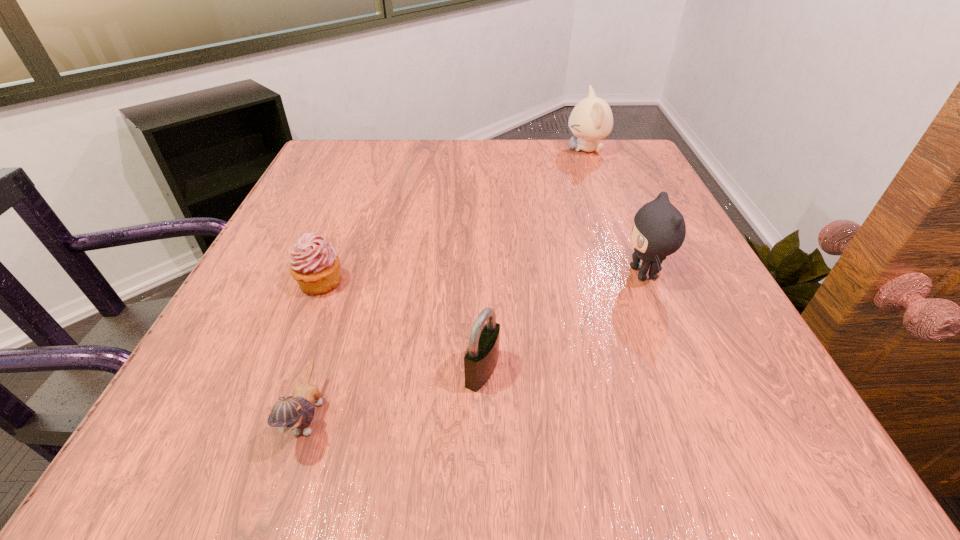
Where is `vacant space situated 0.250m on the front-facing side of the second nearest kitten`? vacant space situated 0.250m on the front-facing side of the second nearest kitten is located at coordinates (482, 273).

At what (x,y) coordinates should I click in order to perform the action: click on free space located 0.070m on the front-facing side of the second nearest kitten. Please return your answer as a coordinate pair (x, y). Looking at the image, I should click on coord(583,273).

Identify the location of free location located on the left of the third object from right to left. Image resolution: width=960 pixels, height=540 pixels. (264, 370).

Locate an element on the screen. free space located 0.280m on the right of the second shortest object is located at coordinates (504, 282).

At what (x,y) coordinates should I click in order to perform the action: click on object positioned at the far edge. Please return your answer as a coordinate pair (x, y). This screenshot has height=540, width=960. Looking at the image, I should click on (591, 119).

Locate an element on the screen. object at the near edge is located at coordinates (296, 413).

The height and width of the screenshot is (540, 960). In order to click on object situated at the left edge in this screenshot , I will do `click(315, 265)`.

Locate an element on the screen. The width and height of the screenshot is (960, 540). object positioned at the far right corner is located at coordinates tap(591, 119).

This screenshot has width=960, height=540. I want to click on free space at the far edge of the desktop, so click(x=419, y=177).

I want to click on free space at the near edge of the desktop, so click(x=642, y=433).